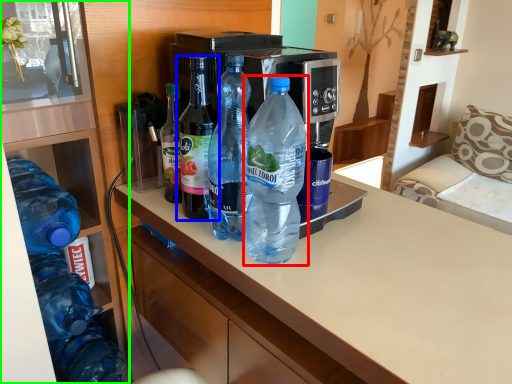
Question: Which is nearer to the bottle (highlighted by a red box)? bottle (highlighted by a blue box) or cabinetry (highlighted by a green box).

Choices:
 (A) bottle
 (B) cabinetry

Answer: (A)